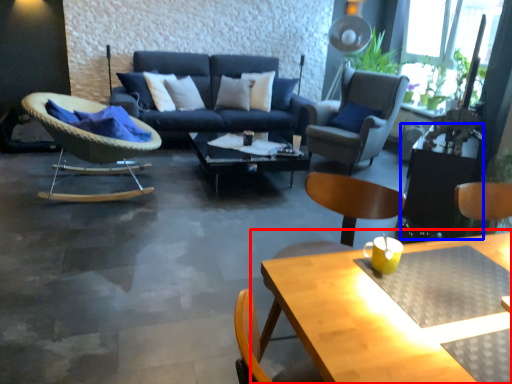
Question: Which point is further to the camera, table (highlighted by a red box) or side table (highlighted by a blue box)?

Choices:
 (A) table
 (B) side table

Answer: (B)